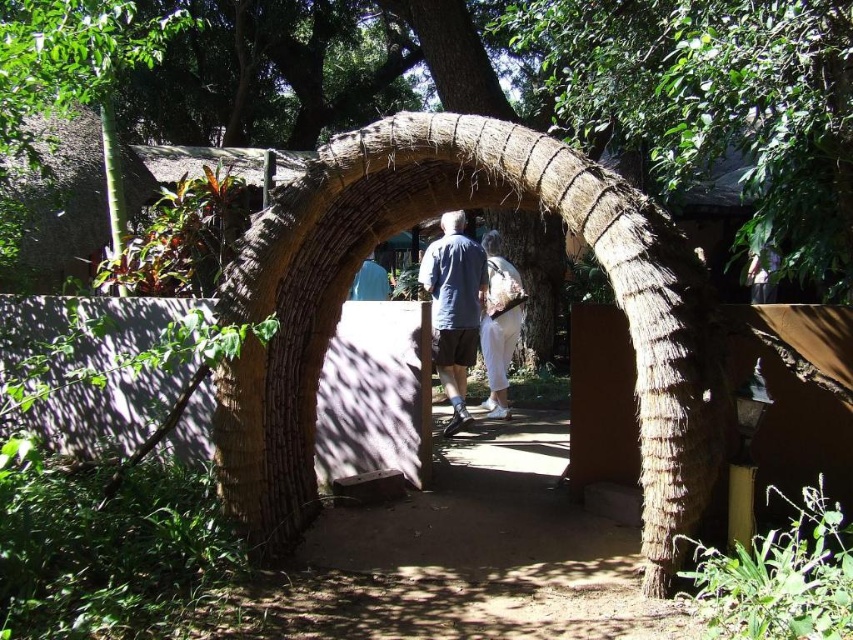
Is white cotton pants at center to the left of light blue fabric at center from the viewer's perspective?

No, white cotton pants at center is not to the left of light blue fabric at center.

Which is in front, point (517, 294) or point (351, 289)?

Point (517, 294) is more forward.

Which is in front, point (492, 372) or point (373, 260)?

Point (492, 372) is in front.

Locate an element on the screen. The image size is (853, 640). white cotton pants at center is located at coordinates (498, 323).

Between point (671, 552) and point (511, 307), which one is positioned in front?

Point (671, 552) is in front.

Is natural thatched arch at center smaller than white cotton pants at center?

No.

This screenshot has width=853, height=640. In order to click on natural thatched arch at center in this screenshot , I will do `click(416, 221)`.

The image size is (853, 640). Describe the element at coordinates (416, 221) in the screenshot. I see `natural thatched arch at center` at that location.

Does natural thatched arch at center appear on the right side of light blue fabric at center?

Yes, natural thatched arch at center is to the right of light blue fabric at center.

Where is `natural thatched arch at center`? The height and width of the screenshot is (640, 853). natural thatched arch at center is located at coordinates click(x=416, y=221).